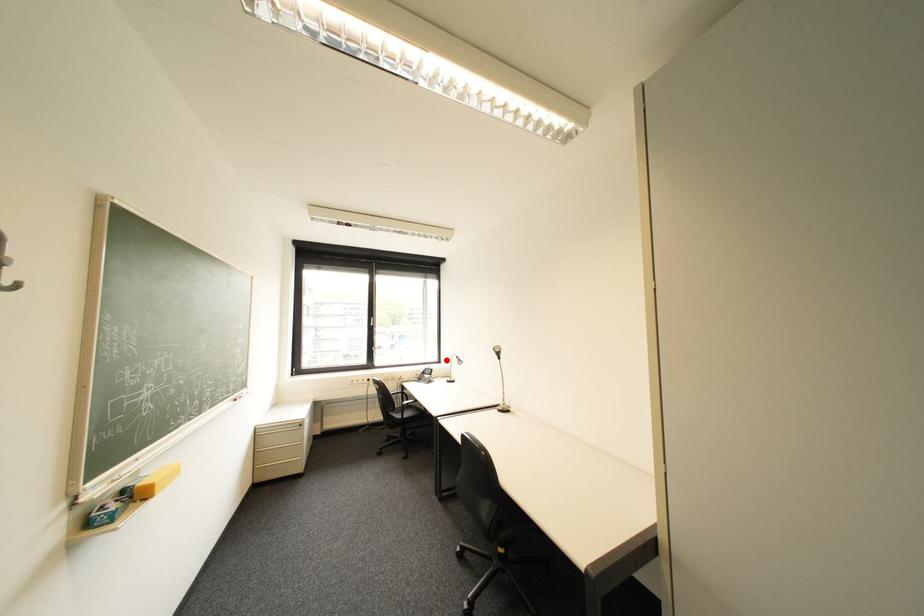
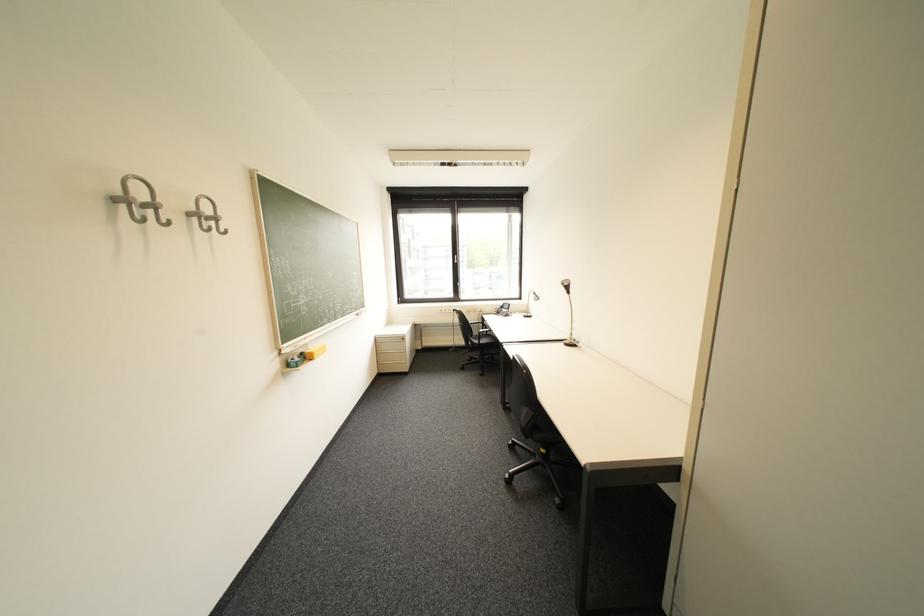
Question: I am providing you with two images of the same scene from different viewpoints. Image1 has a red point marked. In image2, the corresponding 3D location appears at what relative position? Reply with the corresponding letter.

Choices:
 (A) Closer
 (B) Farther

Answer: (A)